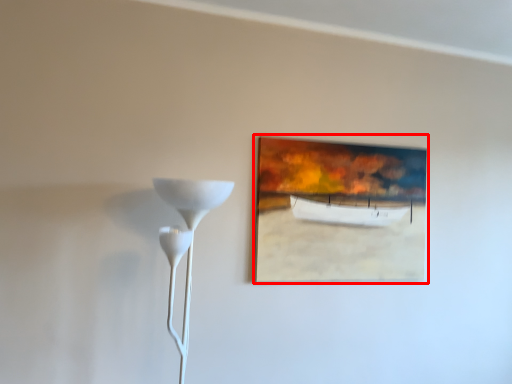
Question: Considering the relative positions of picture frame (annotated by the red box) and lamp in the image provided, where is picture frame (annotated by the red box) located with respect to the staircase?

Choices:
 (A) left
 (B) right

Answer: (B)